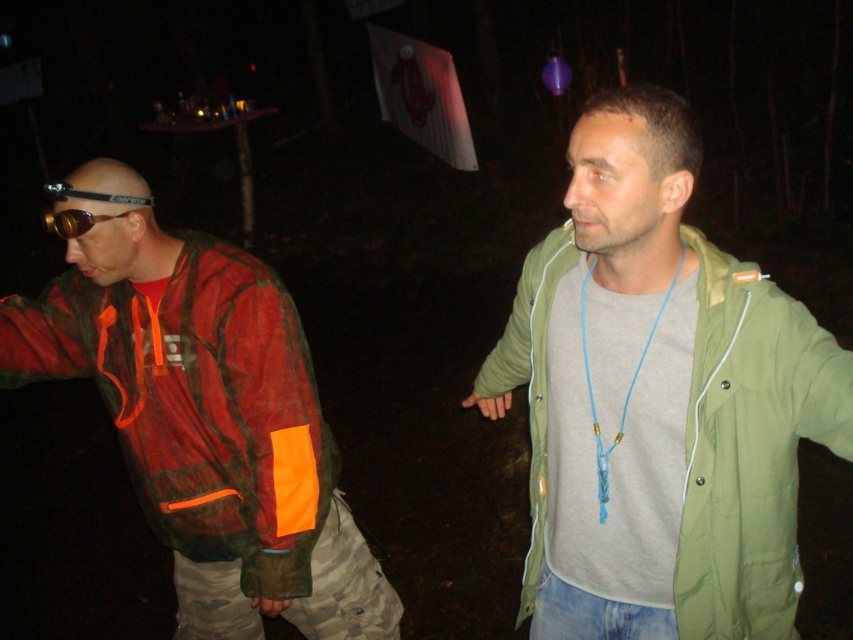
You are a detective examining a nighttime scene in a forest. You notice two items at the scene, the blue string necklace at center and the matte black goggles at left. Which item is smaller?

The blue string necklace at center is smaller than the matte black goggles at left.

You are a photographer trying to capture both the green fabric jacket at center and the blue string necklace at center in a single frame. Given their sizes, which object should you focus on to ensure both fit in the photo without cropping?

The green fabric jacket at center is larger than the blue string necklace at center, so you should focus on capturing the green fabric jacket at center first to ensure both objects fit in the frame.

You are a photographer trying to capture the scene from the perspective of someone standing behind both individuals. Which object, the green fabric jacket at center or the blue string necklace at center, would appear closer to the right edge of your photo?

The green fabric jacket at center is positioned on the right side of the blue string necklace at center, so in the photo taken from behind both individuals, the green fabric jacket at center would appear closer to the right edge.